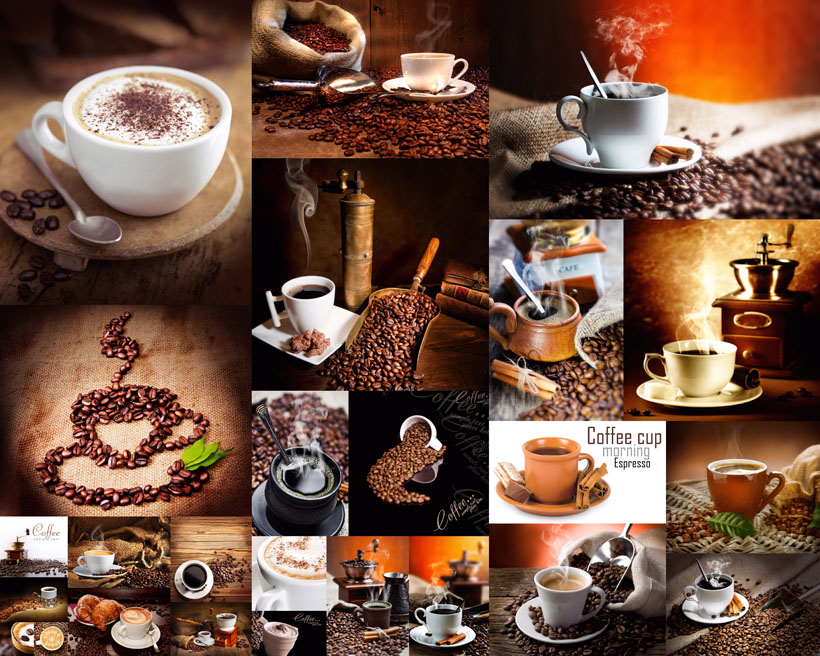
Identify the location of spoon. click(80, 215), click(591, 82), click(508, 276), click(509, 506), click(704, 571).